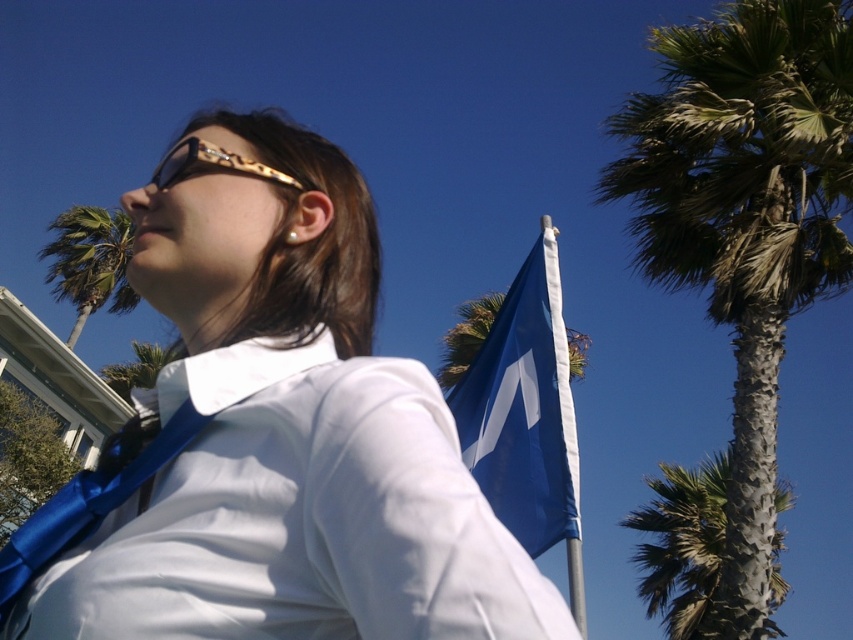
Question: Among these points, which one is nearest to the camera?

Choices:
 (A) (167, 184)
 (B) (706, 509)

Answer: (A)

Question: Does green leafy palm tree at right appear on the right side of green leafy palm tree at left?

Choices:
 (A) no
 (B) yes

Answer: (B)

Question: Which point is farther to the camera?

Choices:
 (A) satin blue tie at center
 (B) gold textured goggles at upper center
 (C) green leafy palm tree at upper right
 (D) green leafy palm tree at right

Answer: (C)

Question: Among these points, which one is nearest to the camera?

Choices:
 (A) (196, 605)
 (B) (727, 160)
 (C) (189, 408)

Answer: (A)

Question: Is blue fabric flag at upper right thinner than green leafy palm tree at right?

Choices:
 (A) yes
 (B) no

Answer: (A)

Question: Can you confirm if green leafy palm tree at upper right is positioned to the left of green leafy palm tree at left?

Choices:
 (A) yes
 (B) no

Answer: (B)